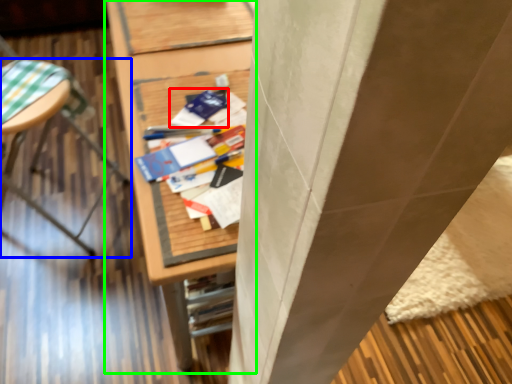
Question: Which object is positioned farthest from paperback book (highlighted by a red box)? Select from furniture (highlighted by a blue box) and furniture (highlighted by a green box).

Choices:
 (A) furniture
 (B) furniture

Answer: (A)